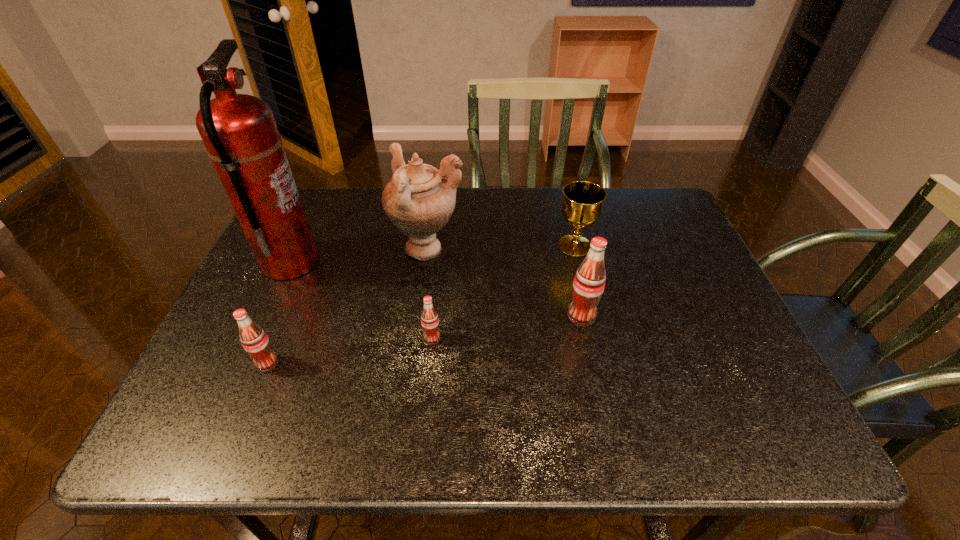
Where is `object at the near left corner`? This screenshot has width=960, height=540. object at the near left corner is located at coordinates (254, 340).

In the image, there is a desktop. Where is `blank space at the far edge`? The image size is (960, 540). blank space at the far edge is located at coordinates (500, 200).

In the image, there is a desktop. What are the coordinates of `vacant space at the left edge` in the screenshot? It's located at (272, 286).

Where is `vacant space at the right edge of the desktop`? This screenshot has width=960, height=540. vacant space at the right edge of the desktop is located at coordinates (669, 287).

This screenshot has height=540, width=960. Identify the location of vacant space at the far left corner of the desktop. (326, 195).

Image resolution: width=960 pixels, height=540 pixels. What are the coordinates of `free space at the near left corner of the desktop` in the screenshot? It's located at (210, 376).

This screenshot has height=540, width=960. In the image, there is a desktop. Find the location of `vacant space at the far right corner`. vacant space at the far right corner is located at coordinates (639, 220).

The width and height of the screenshot is (960, 540). Find the location of `free point between the second soda from left to right and the urn`. free point between the second soda from left to right and the urn is located at coordinates (430, 294).

Image resolution: width=960 pixels, height=540 pixels. I want to click on vacant area between the third tallest object and the urn, so click(505, 283).

Locate an element on the screen. The width and height of the screenshot is (960, 540). vacant space that is in between the chalice and the leftmost soda is located at coordinates (421, 305).